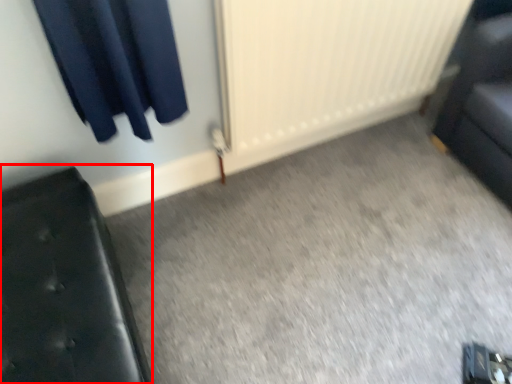
Question: In this image, where is furniture (annotated by the red box) located relative to radiator?

Choices:
 (A) left
 (B) right

Answer: (A)